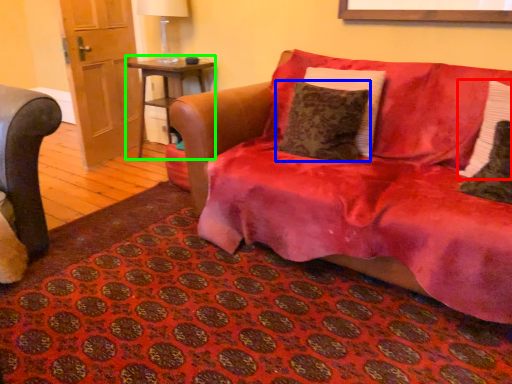
Question: Estimate the real-world distances between objects in this image. Which object is farther from pillow (highlighted by a red box), pillow (highlighted by a blue box) or table (highlighted by a green box)?

Choices:
 (A) pillow
 (B) table

Answer: (B)